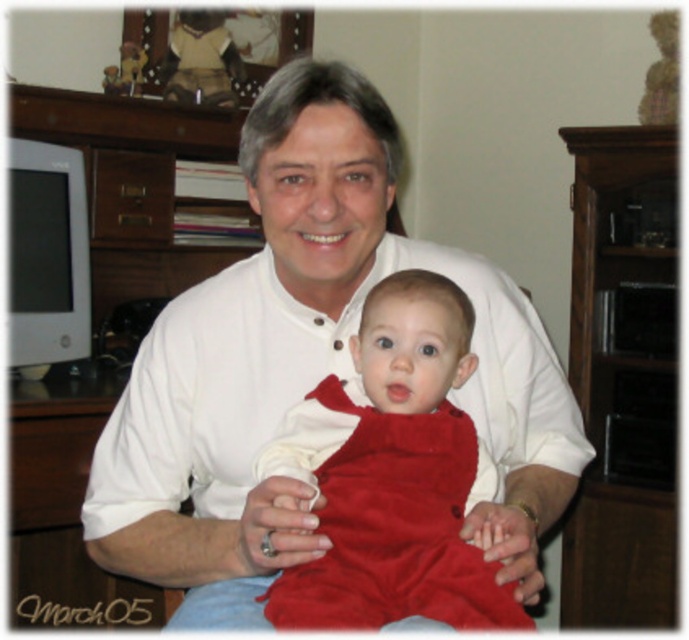
Question: Is white smooth shirt at center wider than velvet red dress at center?

Choices:
 (A) no
 (B) yes

Answer: (B)

Question: Is white smooth shirt at center below velvet red dress at center?

Choices:
 (A) yes
 (B) no

Answer: (B)

Question: Which point is closer to the camera?

Choices:
 (A) velvet red dress at center
 (B) white smooth shirt at center

Answer: (A)

Question: Can you confirm if white smooth shirt at center is positioned below velvet red dress at center?

Choices:
 (A) yes
 (B) no

Answer: (B)